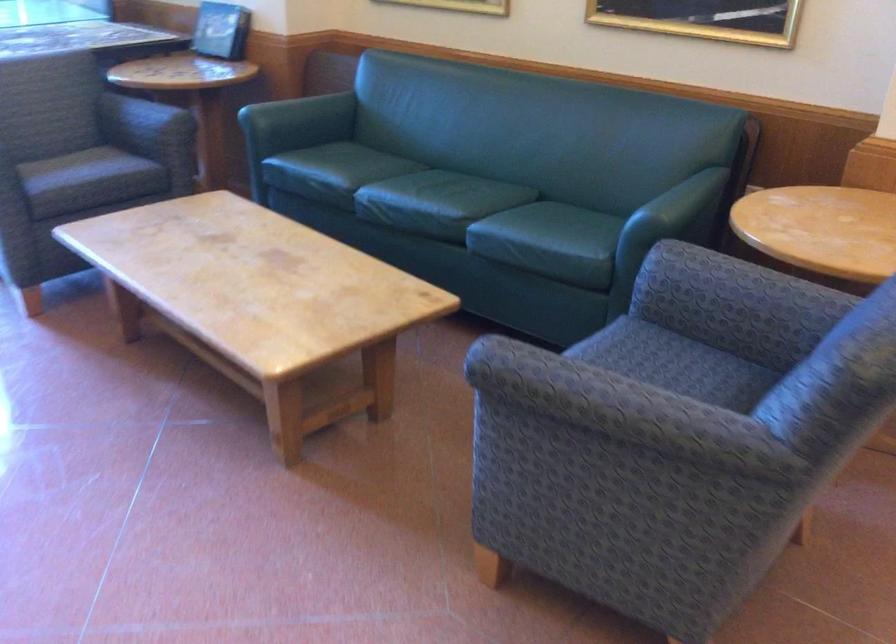
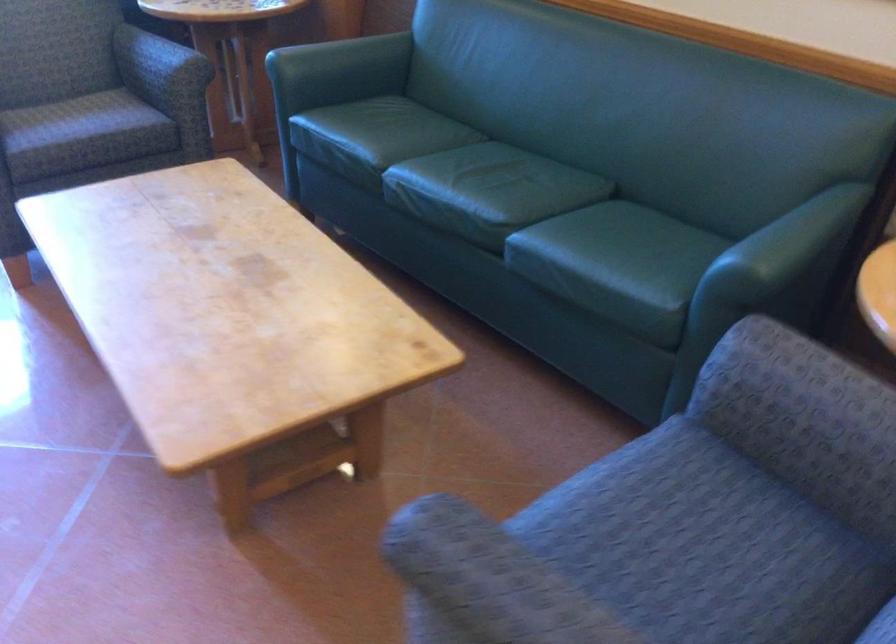
Question: The camera is either moving clockwise (left) or counter-clockwise (right) around the object. The first image is from the beginning of the video and the second image is from the end. Is the camera moving left or right when shooting the video?

Choices:
 (A) Left
 (B) Right

Answer: (B)